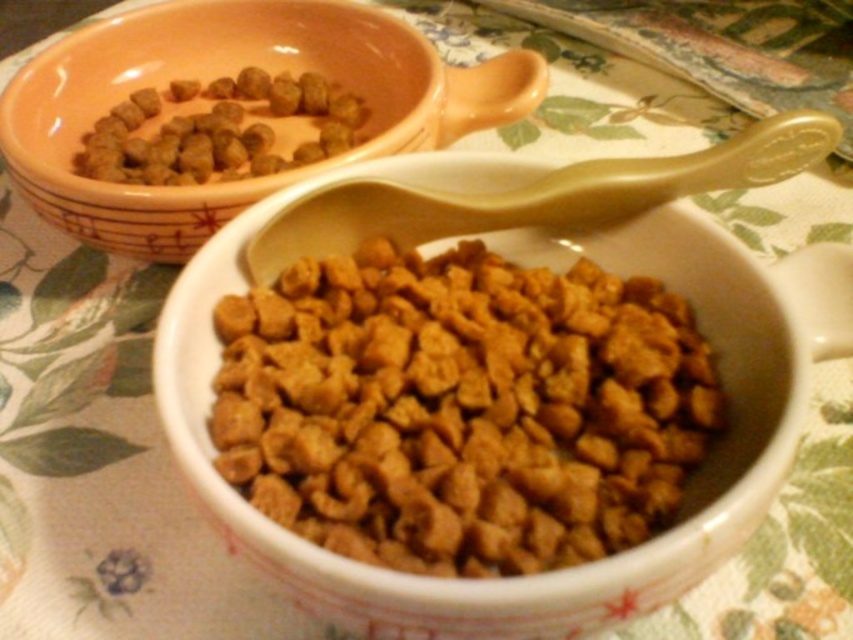
Is point (523, 378) closer to camera compared to point (376, 20)?

Yes, point (523, 378) is closer to viewer.

You are a GUI agent. You are given a task and a screenshot of the screen. Output one action in this format:
    pyautogui.click(x=<x>, y=<y>)
    Task: Click on the brown matte dog food at center
    The height and width of the screenshot is (640, 853).
    Given the screenshot: What is the action you would take?
    pyautogui.click(x=461, y=408)

Locate an element on the screen. Image resolution: width=853 pixels, height=640 pixels. brown matte dog food at center is located at coordinates (461, 408).

The width and height of the screenshot is (853, 640). Find the location of `matte ceramic bowl at upper left`. matte ceramic bowl at upper left is located at coordinates (231, 74).

Identify the location of matte ceramic bowl at upper left. (231, 74).

Is point (549, 541) in front of point (224, 163)?

Yes, point (549, 541) is closer to viewer.

Between brown matte dog food at center and brown matte kibble at upper left, which one appears on the left side from the viewer's perspective?

From the viewer's perspective, brown matte kibble at upper left appears more on the left side.

Who is more distant from viewer, (630, 445) or (334, 141)?

Positioned behind is point (334, 141).

This screenshot has width=853, height=640. In order to click on brown matte dog food at center in this screenshot , I will do `click(461, 408)`.